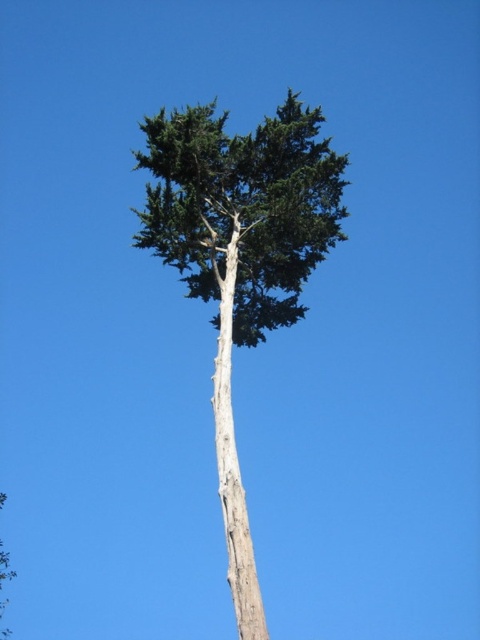
Does point (327, 144) lie in front of point (224, 273)?

No, (327, 144) is further to viewer.

Is point (216, 211) more distant than point (220, 342)?

Yes, point (216, 211) is behind point (220, 342).

Is point (239, 218) farther from viewer compared to point (223, 300)?

Yes, point (239, 218) is farther from viewer.

This screenshot has width=480, height=640. Find the location of `green rough bark tree at center`. green rough bark tree at center is located at coordinates [x=240, y=257].